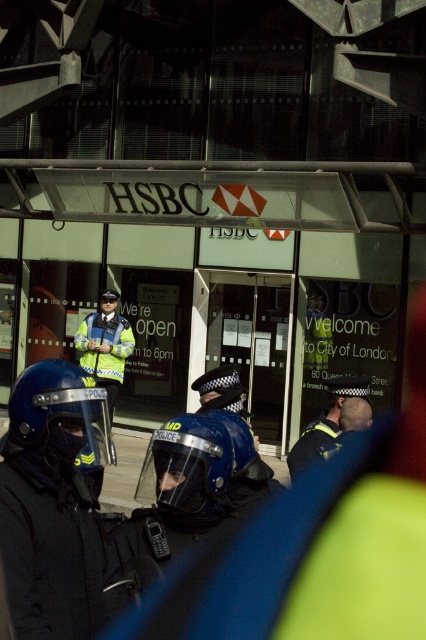
Between blue matte helmet at center and high visibility jacket at center, which one appears on the right side from the viewer's perspective?

blue matte helmet at center

What do you see at coordinates (60, 419) in the screenshot?
I see `blue matte helmet at center` at bounding box center [60, 419].

Does point (39, 432) come behind point (85, 321)?

No, it is in front of (85, 321).

Where is `blue matte helmet at center`? The height and width of the screenshot is (640, 426). blue matte helmet at center is located at coordinates (60, 419).

Can you confirm if matte blue helmet at center is shorter than blue hardshell helmet at center?

Incorrect, matte blue helmet at center's height does not fall short of blue hardshell helmet at center's.

Does matte blue helmet at center have a greater width compared to blue hardshell helmet at center?

Incorrect, matte blue helmet at center's width does not surpass blue hardshell helmet at center's.

Who is more forward, (17, 515) or (192, 435)?

Point (17, 515)

The image size is (426, 640). Identify the location of matte blue helmet at center. (54, 500).

Which of these two, blue matte helmet at center or blue hardshell helmet at center, stands taller?

blue matte helmet at center

Does blue matte helmet at center have a lesser height compared to blue hardshell helmet at center?

Incorrect, blue matte helmet at center's height does not fall short of blue hardshell helmet at center's.

Between point (77, 392) and point (181, 420), which one is positioned behind?

Positioned behind is point (181, 420).

The height and width of the screenshot is (640, 426). Identify the location of blue matte helmet at center. (60, 419).